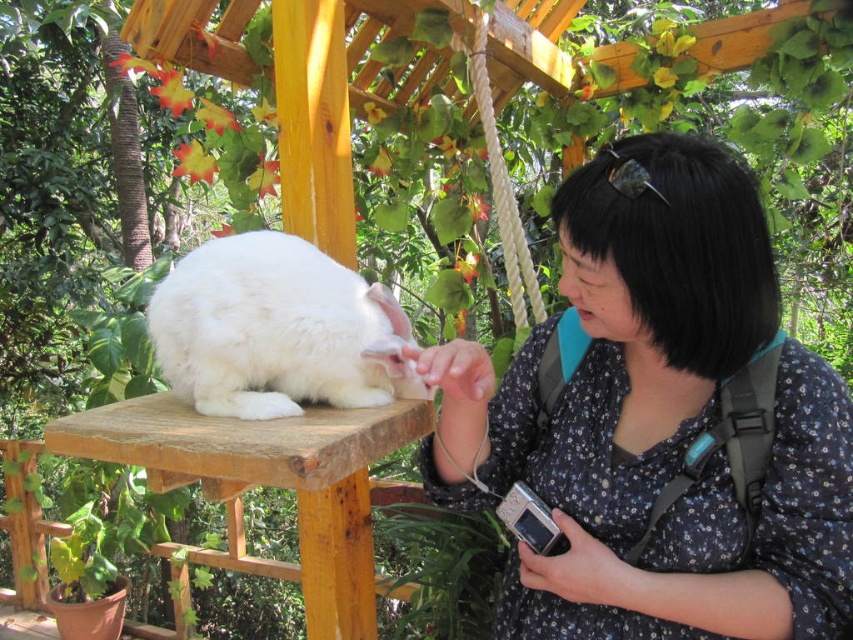
Consider the image. You are standing in a garden and see a white fluffy rabbit at center and a wooden stool at center. Which object is more to the right?

The white fluffy rabbit at center is more to the right because it is positioned on the right side of the wooden stool at center.

You are a photographer standing 5 feet away from the white fluffy rabbit at center. You want to take a closeup photo of its ear. Can you move closer to the rabbit to get a better shot without exceeding the maximum allowed distance of 3 feet? Please explain your reasoning.

The white fluffy rabbit at center is 3.42 feet away from the camera. Since you are already 5 feet away from the rabbit, moving closer would reduce the distance. However, the maximum allowed distance is 3 feet, so you can move closer to within 3 feet to take the photo.